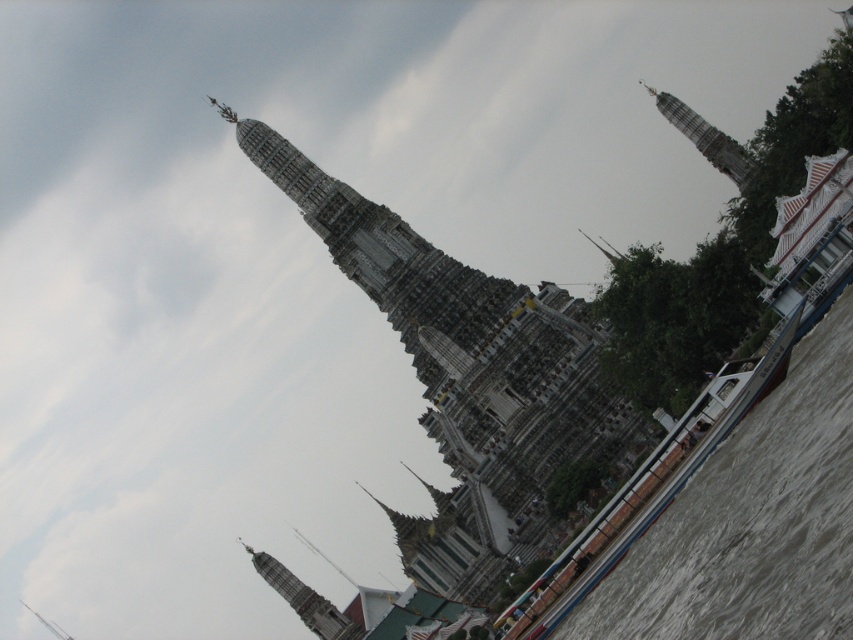
You are a tourist standing at the riverbank facing the temple complex. You notice two structures in the scene. Which structure would appear bigger to you, the stone temple at center or the gray stone tower at upper right?

The stone temple at center appears bigger than the gray stone tower at upper right because it is larger in size according to the description.

You are a photographer standing at the riverbank capturing the temple complex. You notice two points marked in the image. Which of the two points, point (527,518) or point (265,561), is closer to your camera lens?

Point (527,518) is closer to the camera than point (265,561).